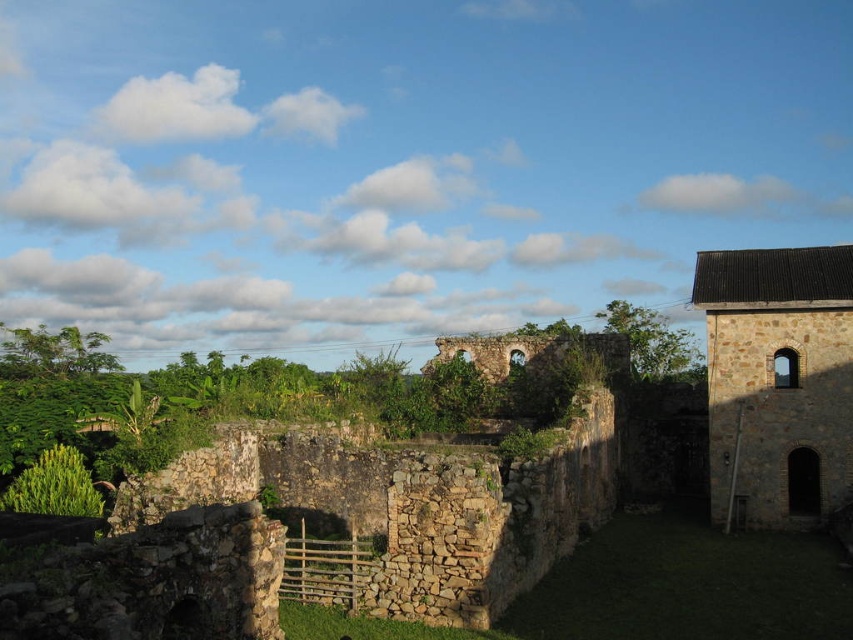
Which is more to the left, brown stone tower at right or green leafy bush at lower left?

green leafy bush at lower left is more to the left.

Which is above, brown stone tower at right or green leafy bush at lower left?

Positioned higher is brown stone tower at right.

Find the location of a particular element. brown stone tower at right is located at coordinates (776, 381).